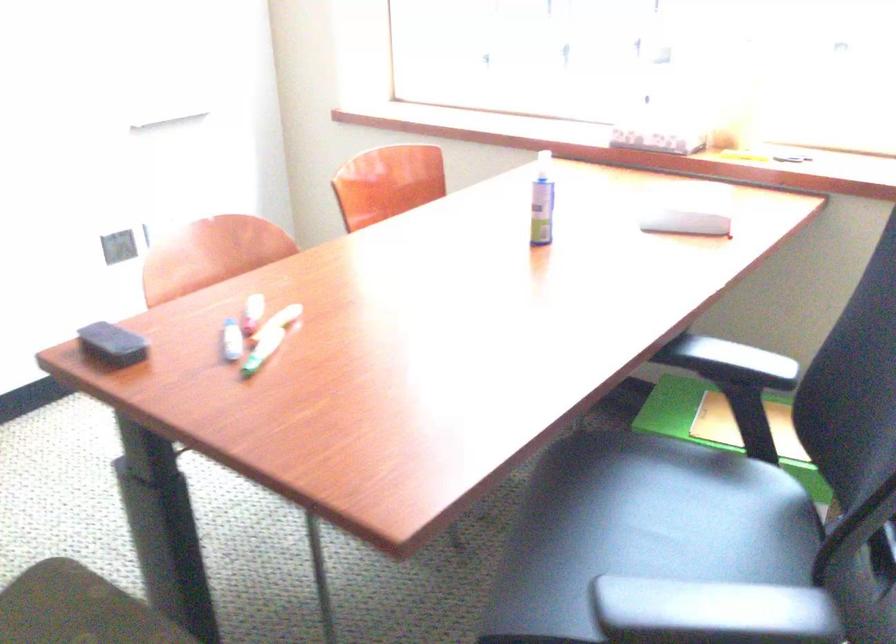
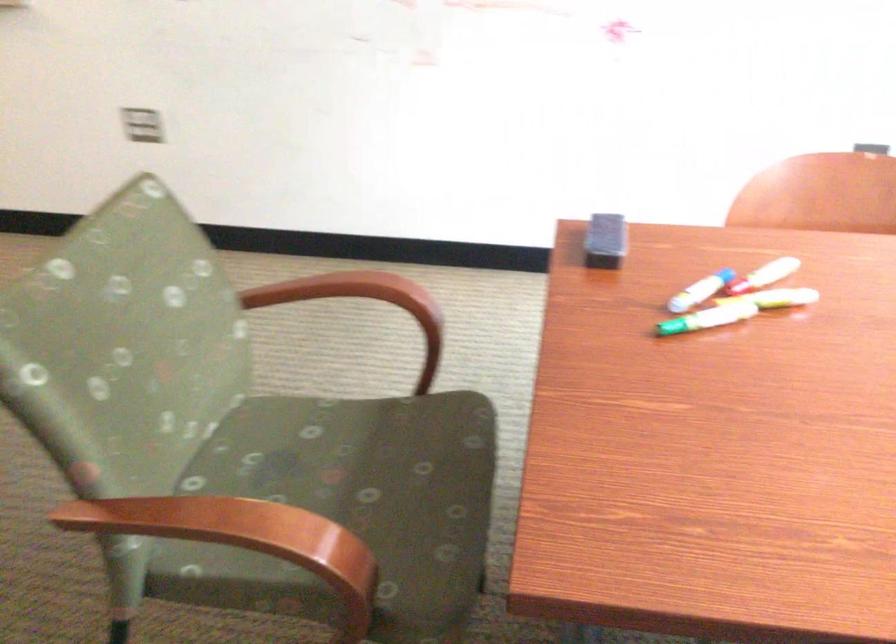
Where in the second image is the point corresponding to (288,317) from the first image?

(776, 298)